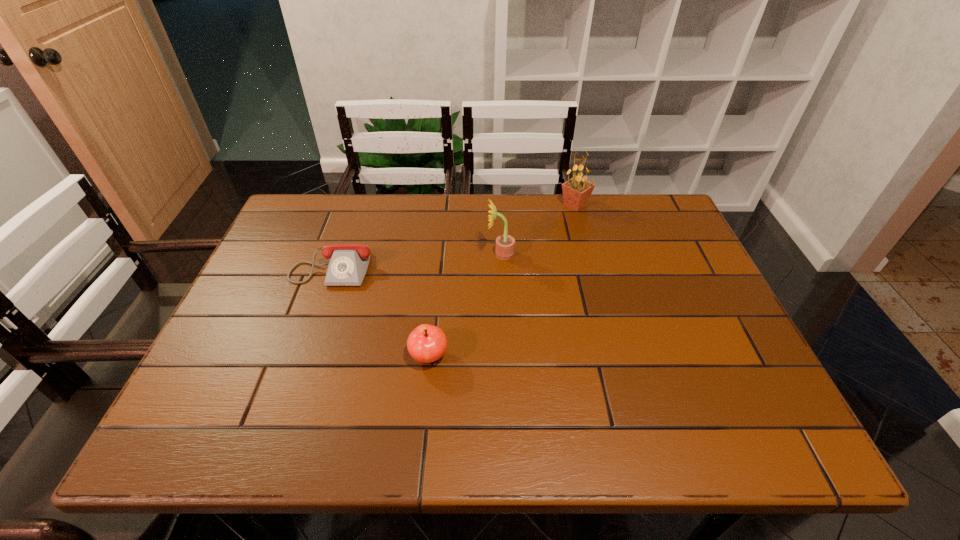
The width and height of the screenshot is (960, 540). What are the coordinates of `free region that satisfies the following two spatial constraints: 1. on the dial of the leftmost object; 2. on the left side of the third object from right to left` in the screenshot? It's located at (300, 357).